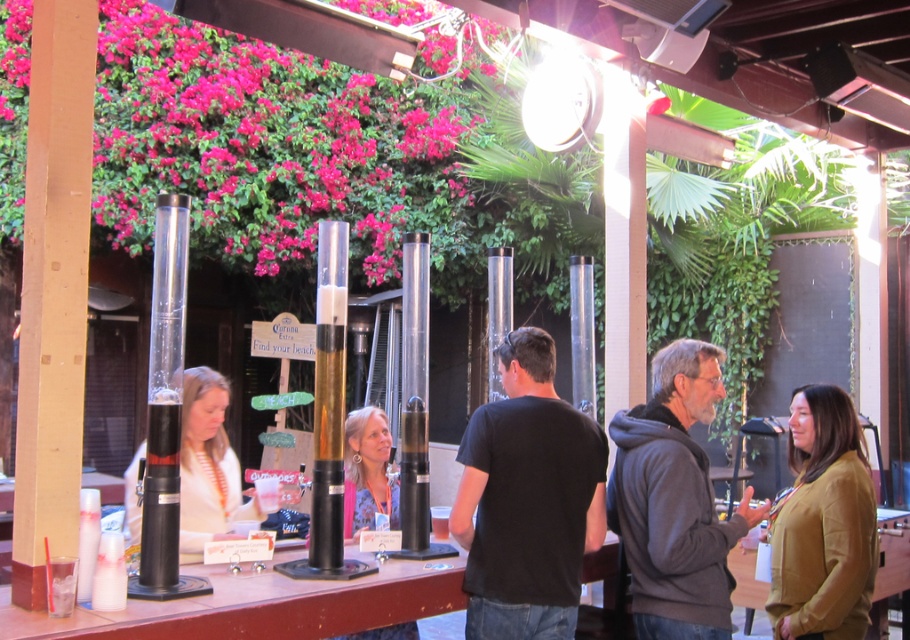
Question: Estimate the real-world distances between objects in this image. Which object is closer to the gray fleece jacket at center?

Choices:
 (A) velvet mustard jacket at lower right
 (B) white striped shirt at left
 (C) floral-patterned blouse at center

Answer: (A)

Question: Which object appears closest to the camera in this image?

Choices:
 (A) velvet mustard jacket at lower right
 (B) floral-patterned blouse at center

Answer: (A)

Question: Is the position of gray fleece jacket at center less distant than that of floral-patterned blouse at center?

Choices:
 (A) no
 (B) yes

Answer: (B)

Question: Is black t-shirt at center further to camera compared to wooden table at lower right?

Choices:
 (A) yes
 (B) no

Answer: (B)

Question: Is black t-shirt at center wider than gray fleece jacket at center?

Choices:
 (A) yes
 (B) no

Answer: (B)

Question: Which object is farther from the camera taking this photo?

Choices:
 (A) gray fleece jacket at center
 (B) white striped shirt at left
 (C) wooden table at lower right

Answer: (C)